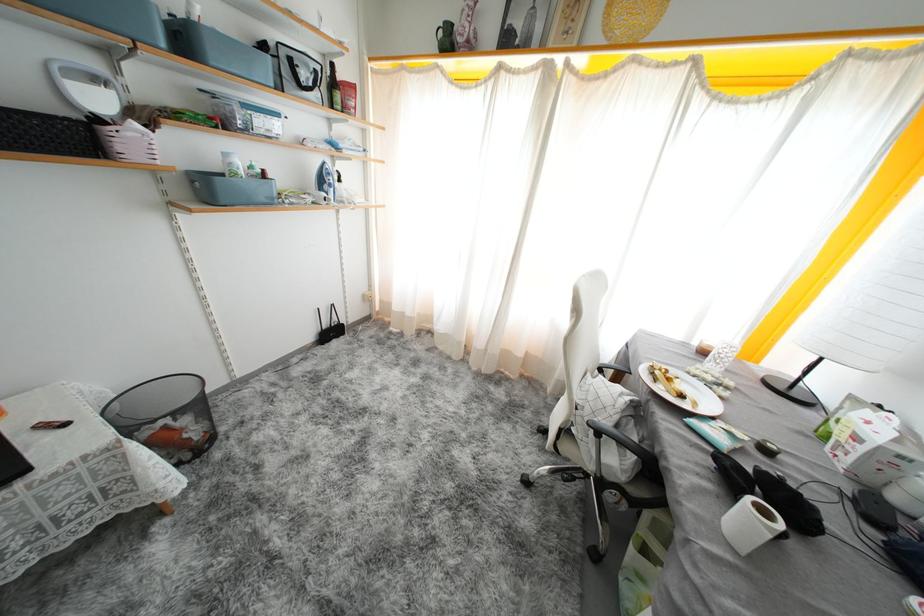
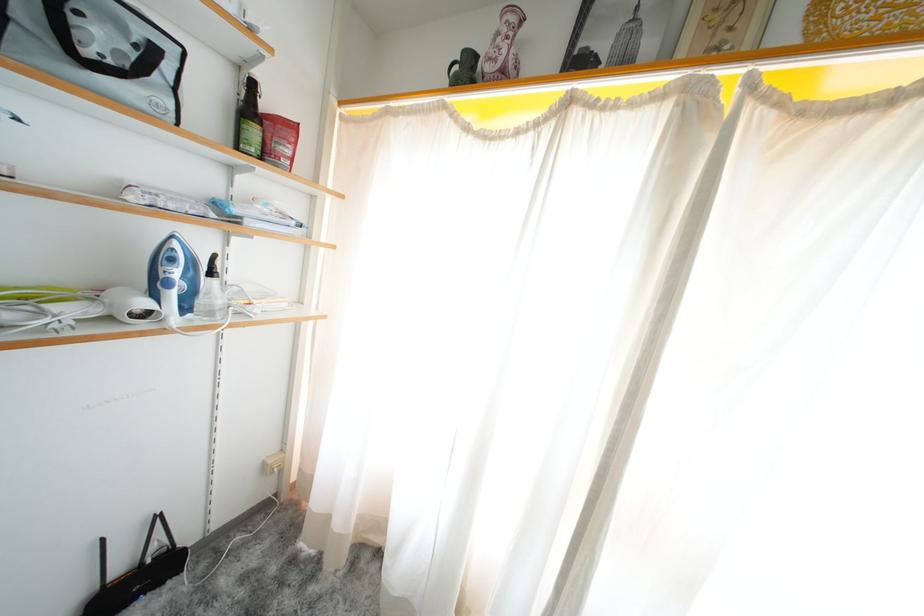
Locate, in the second image, the point that corresponds to (x=337, y=337) in the first image.

(143, 586)